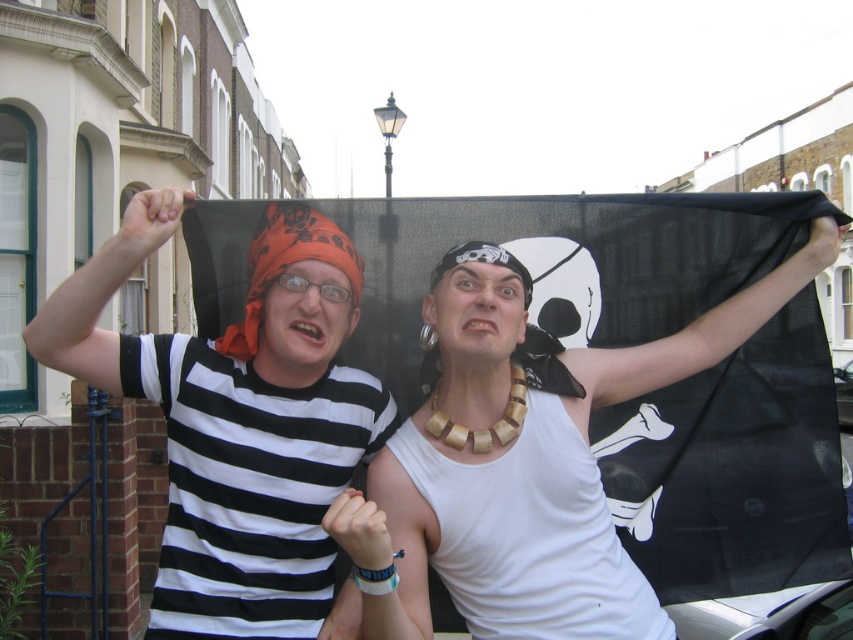
You are a photographer trying to capture a clear shot of both the matte black flag at center and the matte black bandana at left. Since you want both items to appear equally prominent in the photo, which object should you move closer to the camera and why?

You should move the matte black bandana at left closer to the camera because the matte black flag at center is larger in size than the matte black bandana at left. By moving the smaller bandana forward, it will appear larger in the photo, balancing its prominence with the flag.

You are a photographer trying to capture the matte black flag at center and the matte black bandana at left. Which object should you focus on first if you want to take a photo that includes both in the frame without moving the camera?

The matte black flag at center is above the matte black bandana at left, so you should focus on the matte black bandana at left first to ensure both are in the frame without moving the camera.